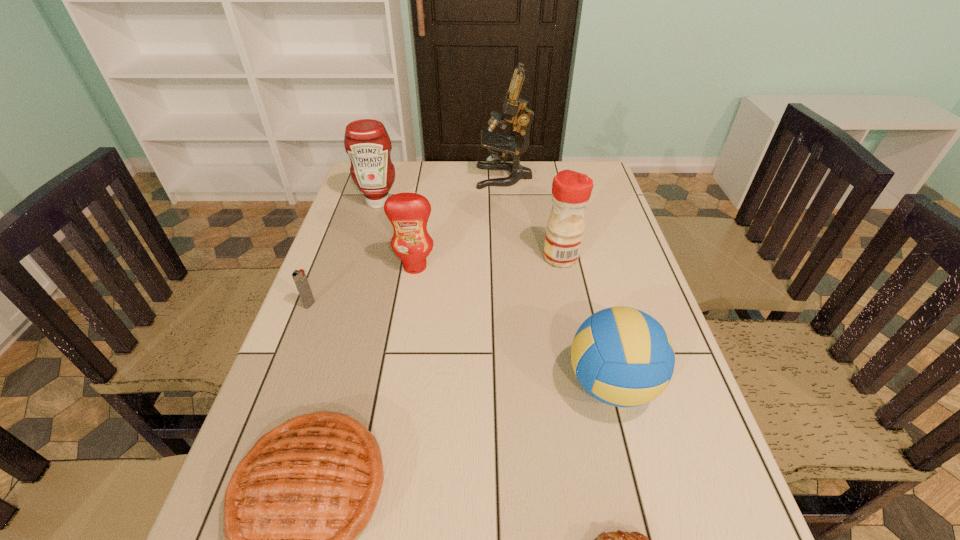
Where is `object that is the fourth closest to the fifth farthest object`? Image resolution: width=960 pixels, height=540 pixels. object that is the fourth closest to the fifth farthest object is located at coordinates (571, 190).

Where is `object that is the sixth closest to the volleyball`? The width and height of the screenshot is (960, 540). object that is the sixth closest to the volleyball is located at coordinates (515, 111).

The height and width of the screenshot is (540, 960). I want to click on condiment that is the second closest one to the shortest condiment, so click(x=571, y=190).

Identify which condiment is the nearest to the pie. Please provide its 2D coordinates. Your answer should be formatted as a tuple, i.e. [(x, y)], where the tuple contains the x and y coordinates of a point satisfying the conditions above.

[(408, 213)]

Locate an element on the screen. This screenshot has height=540, width=960. free region that satisfies the following two spatial constraints: 1. on the front side of the rightmost condiment; 2. on the left side of the volleyball is located at coordinates (588, 384).